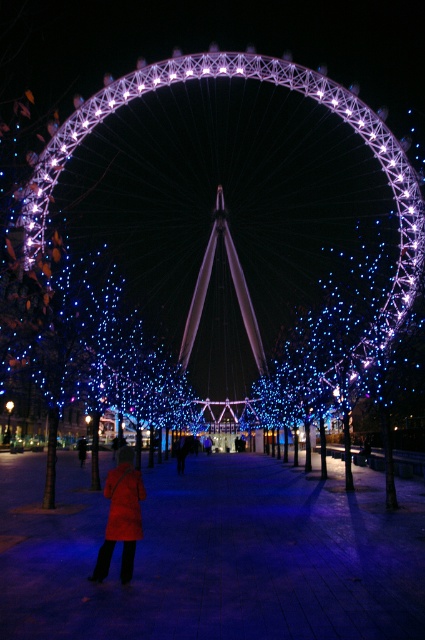
Is point (44, 173) closer to camera compared to point (95, 579)?

No, it is not.

Who is higher up, illuminated steel ferris wheel at center or red wool coat at center?

Positioned higher is illuminated steel ferris wheel at center.

Measure the distance between illuminated steel ferris wheel at center and camera.

They are 465.55 feet apart.

Find the location of a particular element. The height and width of the screenshot is (640, 425). illuminated steel ferris wheel at center is located at coordinates (244, 77).